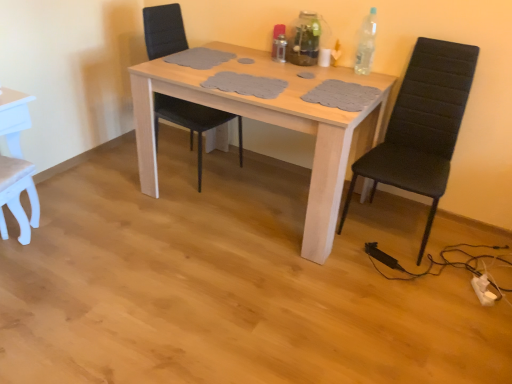
Question: Looking at their shapes, would you say light wood table at center is wider or thinner than metallic silver bottle at upper center, the 1th bottle positioned from the left?

Choices:
 (A) wide
 (B) thin

Answer: (A)

Question: From a real-world perspective, is light wood table at center above or below metallic silver bottle at upper center, the 1th bottle positioned from the left?

Choices:
 (A) below
 (B) above

Answer: (A)

Question: Which of these objects is positioned farthest from the clear plastic bottle at upper right, the 1th bottle viewed from the right?

Choices:
 (A) black leather chair at center, which appears as the second chair when viewed from the left
 (B) white matte chair at lower left, which is the third chair in right-to-left order
 (C) black fabric chair at right, marked as the 1th chair in a right-to-left arrangement
 (D) transparent glass vase at upper center, arranged as the 2th bottle when viewed from the right
 (E) metallic silver bottle at upper center, arranged as the third bottle when viewed from the right

Answer: (B)

Question: Estimate the real-world distances between objects in this image. Which object is closer to the black fabric chair at right, marked as the 3th chair in a left-to-right arrangement?

Choices:
 (A) metallic silver bottle at upper center, arranged as the third bottle when viewed from the right
 (B) light wood table at center
 (C) white matte chair at lower left, which is the third chair in right-to-left order
 (D) transparent glass vase at upper center, the 2th bottle in the left-to-right sequence
 (E) black leather chair at center, acting as the second chair starting from the right

Answer: (B)